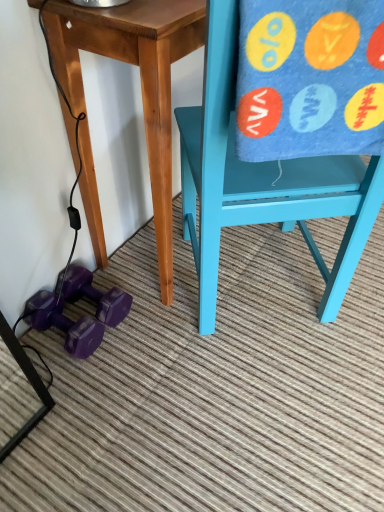
What are the coordinates of `free space in front of matte blue chair at right` in the screenshot? It's located at (246, 415).